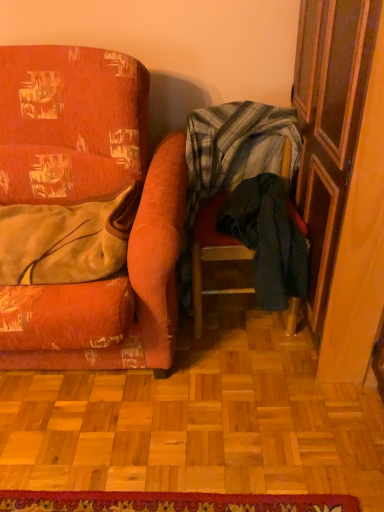
I want to click on vacant space underneath red woven mat at lower center (from a real-world perspective), so click(167, 504).